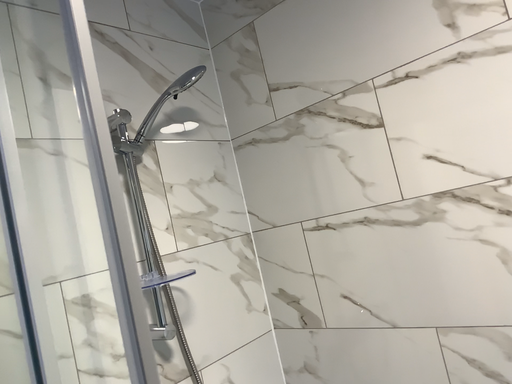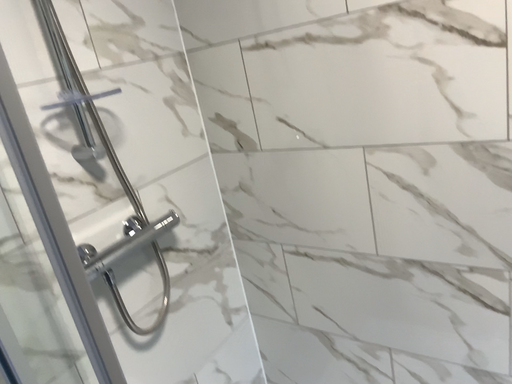
Question: Which way did the camera rotate in the video?

Choices:
 (A) rotated right
 (B) rotated left

Answer: (A)